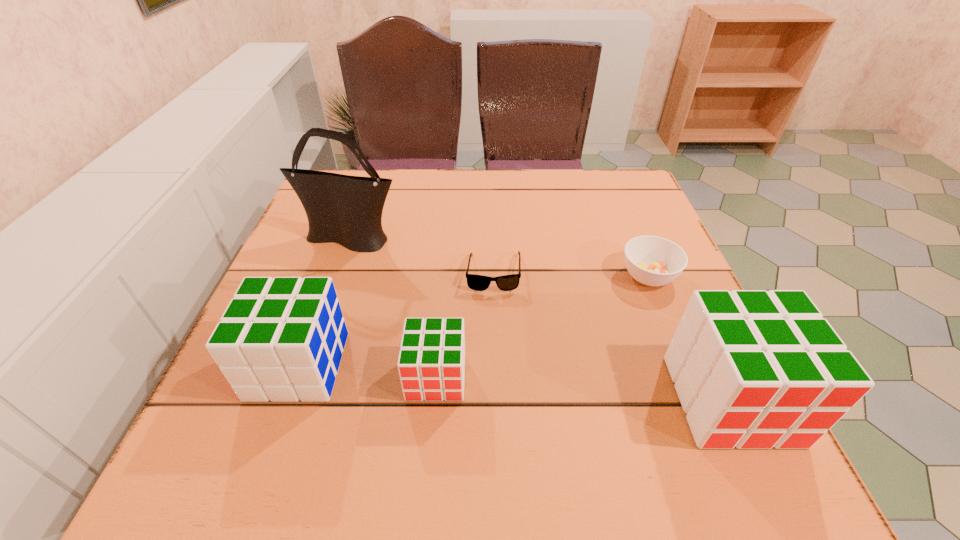
Where is `the leftmost cube`? The height and width of the screenshot is (540, 960). the leftmost cube is located at coordinates (281, 339).

What are the coordinates of `the second tallest cube` in the screenshot? It's located at (281, 339).

Identify the location of the second cube from right to left. (431, 364).

Identify the location of the third shortest object. (431, 364).

What are the coordinates of `the rightmost cube` in the screenshot? It's located at (753, 369).

This screenshot has height=540, width=960. I want to click on sunglasses, so click(475, 282).

Find the location of a particular element. the tallest object is located at coordinates (343, 209).

You are a GUI agent. You are given a task and a screenshot of the screen. Output one action in this format:
    pyautogui.click(x=<x>, y=<y>)
    Task: Click on the farthest object
    The image size is (960, 540).
    Given the screenshot: What is the action you would take?
    pyautogui.click(x=343, y=209)

Find the location of a particular element. soup bowl is located at coordinates (651, 260).

At what (x,y) coordinates should I click in order to perform the action: click on vacant region located on the front-facing side of the shortest object. Please return your answer as a coordinate pair (x, y). Looking at the image, I should click on (497, 383).